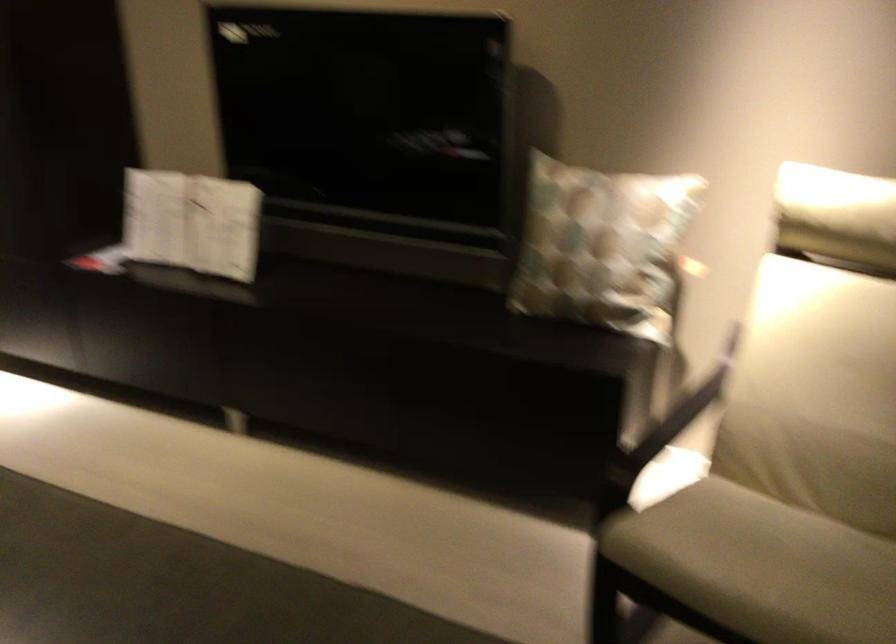
At what (x,y) coordinates should I click in order to perform the action: click on patterned pillow. Please return your answer as a coordinate pair (x, y). Looking at the image, I should click on (602, 245).